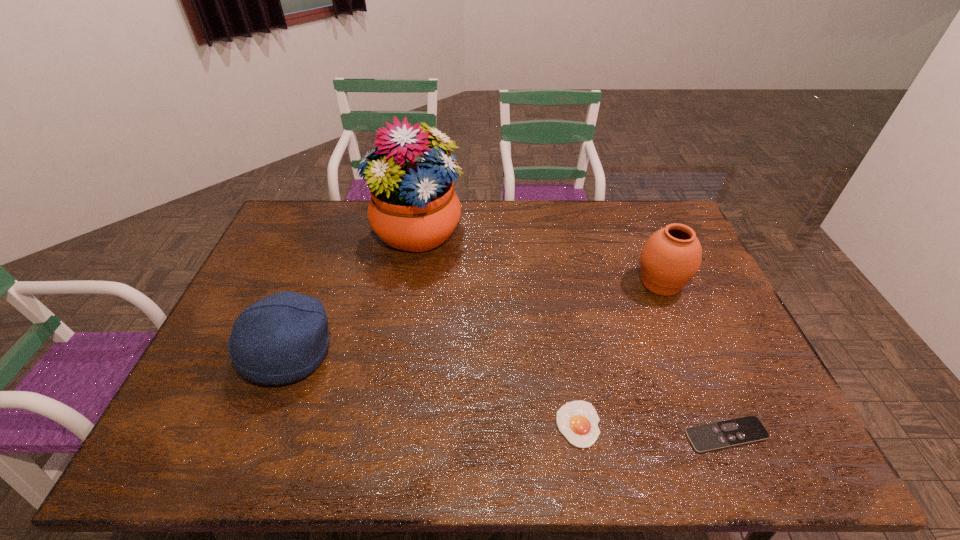
Locate an element on the screen. the tallest object is located at coordinates (413, 207).

Locate an element on the screen. Image resolution: width=960 pixels, height=540 pixels. urn is located at coordinates (670, 258).

I want to click on the third nearest object, so click(281, 338).

Image resolution: width=960 pixels, height=540 pixels. I want to click on remote control, so (738, 431).

At what (x,y) coordinates should I click in order to perform the action: click on the third object from left to right. Please return your answer as a coordinate pair (x, y). This screenshot has width=960, height=540. Looking at the image, I should click on (577, 420).

Identify the location of vacant space located on the front of the tallest object. (x=402, y=320).

The height and width of the screenshot is (540, 960). Find the location of `blank space located on the back of the urn`. blank space located on the back of the urn is located at coordinates (644, 241).

Where is `vacant space located 0.120m on the back of the skullcap`? Image resolution: width=960 pixels, height=540 pixels. vacant space located 0.120m on the back of the skullcap is located at coordinates (314, 290).

I want to click on vacant area located 0.180m on the back of the remote control, so click(x=693, y=356).

Identify the location of free space located 0.130m on the back of the third object from left to right. [x=567, y=357].